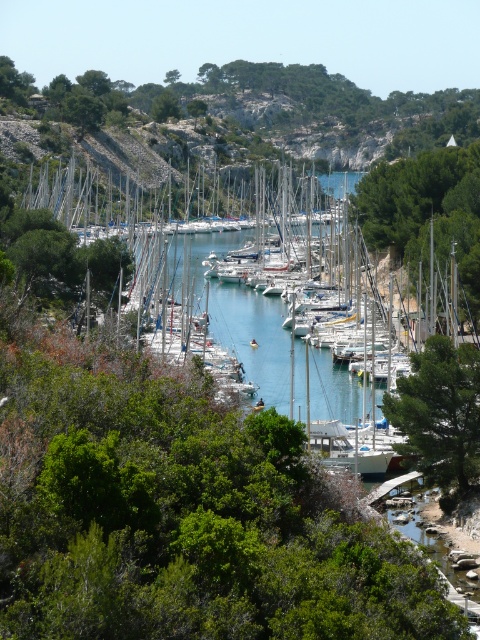
Question: Is green leafy tree at center positioned behind green leafy tree at upper center?

Choices:
 (A) no
 (B) yes

Answer: (A)

Question: Among these objects, which one is farthest from the camera?

Choices:
 (A) green leafy tree at center
 (B) green leafy tree at upper center

Answer: (B)

Question: Among these objects, which one is farthest from the camera?

Choices:
 (A) green leafy tree at center
 (B) green leafy tree at upper center
 (C) green leafy tree at right

Answer: (B)

Question: Which of the following is the farthest from the observer?

Choices:
 (A) green leafy tree at upper center
 (B) green leafy tree at center

Answer: (A)

Question: Is green leafy tree at right further to camera compared to green leafy tree at upper center?

Choices:
 (A) yes
 (B) no

Answer: (B)

Question: Does green leafy tree at right appear on the left side of green leafy tree at center?

Choices:
 (A) no
 (B) yes

Answer: (A)